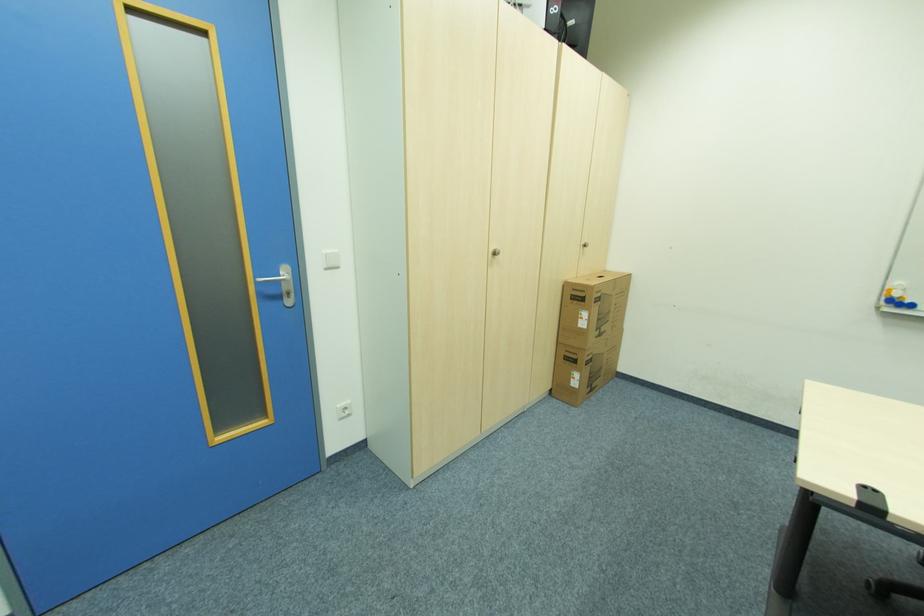
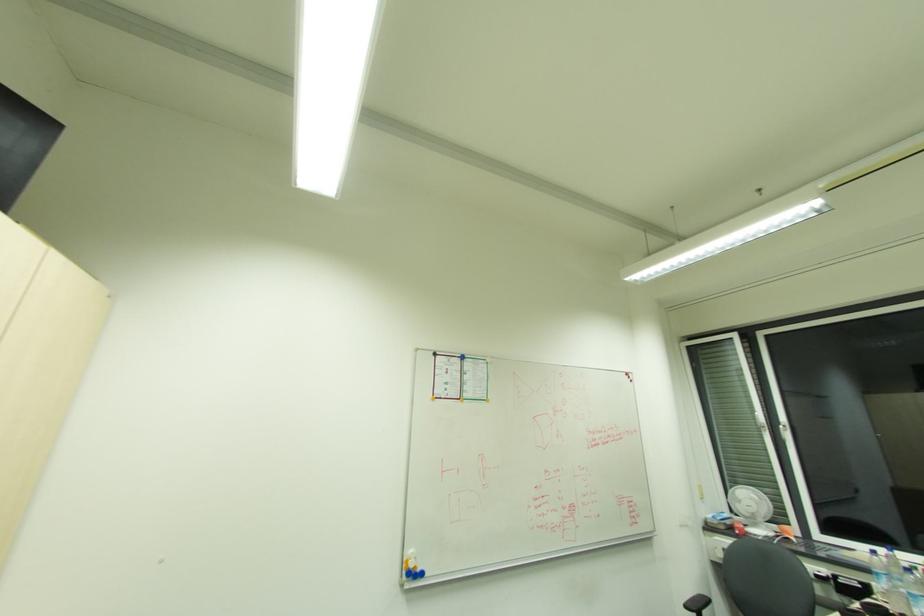
Looking at this image, first-person continuous shooting, in which direction is the camera rotating?

The rotation direction of the camera is right-up.